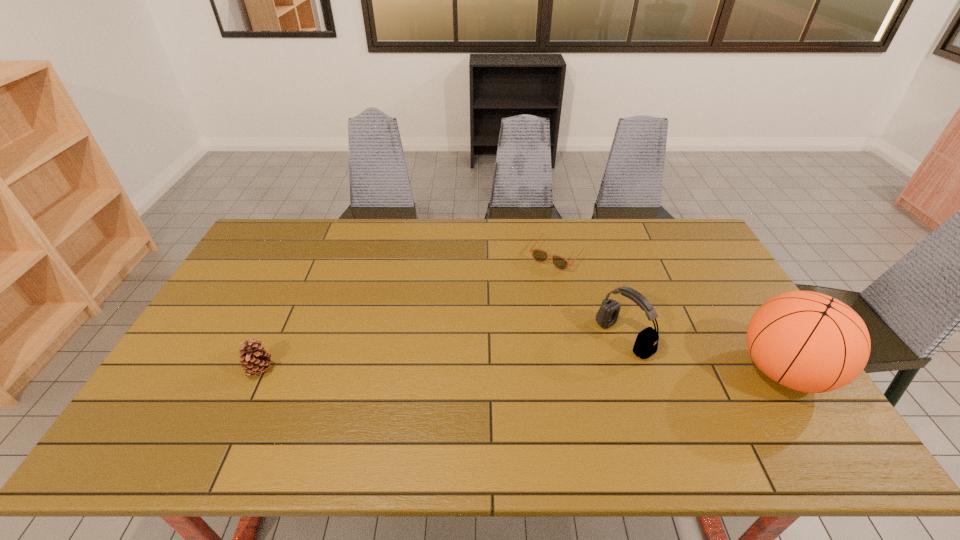
In order to click on free space located 0.120m on the headband of the headset in this screenshot , I will do `click(575, 372)`.

You are a GUI agent. You are given a task and a screenshot of the screen. Output one action in this format:
    pyautogui.click(x=<x>, y=<y>)
    Task: Click on the free space located 0.300m on the headband of the headset
    This screenshot has height=540, width=960.
    Given the screenshot: What is the action you would take?
    pyautogui.click(x=522, y=406)

You are a GUI agent. You are given a task and a screenshot of the screen. Output one action in this format:
    pyautogui.click(x=<x>, y=<y>)
    Task: Click on the vacant region located on the front-facing side of the shortest object
    This screenshot has height=540, width=960.
    Given the screenshot: What is the action you would take?
    pyautogui.click(x=540, y=279)

This screenshot has height=540, width=960. I want to click on free space located on the front-facing side of the shortest object, so click(x=511, y=317).

The image size is (960, 540). I want to click on vacant space located on the front-facing side of the shortest object, so (537, 282).

The image size is (960, 540). What are the coordinates of `object present at the far edge` in the screenshot? It's located at (539, 255).

In order to click on object located in the near edge section of the desktop in this screenshot , I will do `click(807, 341)`.

The image size is (960, 540). Identify the location of object situated at the right edge. (807, 341).

Image resolution: width=960 pixels, height=540 pixels. I want to click on object located at the near right corner, so click(807, 341).

Locate an element on the screen. The width and height of the screenshot is (960, 540). free space at the far edge is located at coordinates pyautogui.click(x=660, y=253).